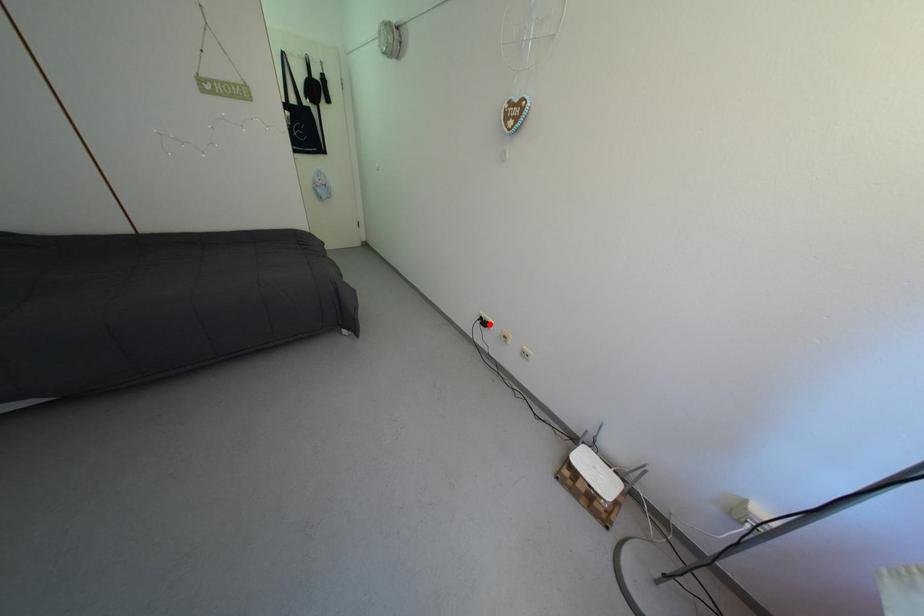
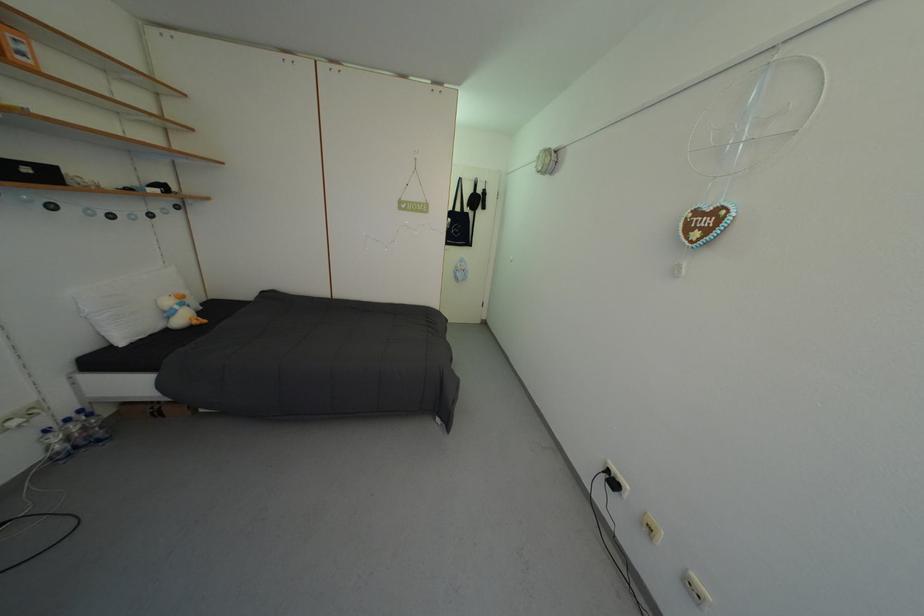
The point at the highlighted location is marked in the first image. Where is the corresponding point in the second image?

(616, 477)